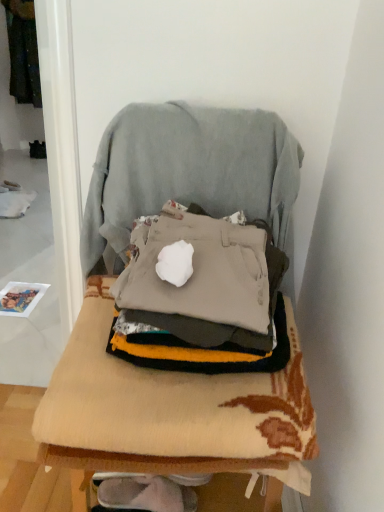
In order to face light gray fabric swivel chair at center, should I rotate leftwards or rightwards?

Rotate your view left by about 1.051°.

What do you see at coordinates (192, 169) in the screenshot? The height and width of the screenshot is (512, 384). I see `light gray fabric swivel chair at center` at bounding box center [192, 169].

At what (x,y) coordinates should I click in order to perform the action: click on dark green fabric at upper left. Please return your answer as a coordinate pair (x, y). This screenshot has height=512, width=384. Looking at the image, I should click on (23, 52).

This screenshot has width=384, height=512. What do you see at coordinates (167, 406) in the screenshot?
I see `beige fabric chair at center` at bounding box center [167, 406].

Where is `beige knitted blanket at center`? beige knitted blanket at center is located at coordinates (168, 405).

Describe the element at coordinates (168, 405) in the screenshot. I see `beige knitted blanket at center` at that location.

Where is `light gray fabric swivel chair at center`? The width and height of the screenshot is (384, 512). light gray fabric swivel chair at center is located at coordinates (192, 169).

Can you see dark green fabric at upper left touching light gray fabric swivel chair at center?

No, dark green fabric at upper left is not in contact with light gray fabric swivel chair at center.

Looking at this image, could light gray fabric swivel chair at center be considered to be inside dark green fabric at upper left?

No.

Does dark green fabric at upper left have a greater width compared to light gray fabric swivel chair at center?

Correct, the width of dark green fabric at upper left exceeds that of light gray fabric swivel chair at center.

Which is in front, point (29, 60) or point (108, 149)?

Point (108, 149)

Which object is positioned more to the left, beige fabric chair at center or beige knitted blanket at center?

beige fabric chair at center.

Which object is further away from the camera, beige fabric chair at center or beige knitted blanket at center?

beige knitted blanket at center is further away from the camera.

Considering the relative sizes of beige fabric chair at center and beige knitted blanket at center in the image provided, is beige fabric chair at center shorter than beige knitted blanket at center?

No.

Is point (248, 388) closer to camera compared to point (290, 432)?

No, (248, 388) is further to viewer.

Based on the photo, which object is further away from the camera taking this photo, beige knitted blanket at center or beige fabric chair at center?

Positioned behind is beige knitted blanket at center.

Identify the location of furniture to the left of beige knitted blanket at center. (167, 406).

Is beige knitted blanket at center inside the boundaries of beige fabric chair at center, or outside?

A: beige knitted blanket at center is enclosed within beige fabric chair at center.

From the image's perspective, relative to dark green fabric at upper left, is beige knitted blanket at center above or below?

beige knitted blanket at center is below dark green fabric at upper left.

There is a beige knitted blanket at center. Where is `clothing above it (from a real-world perspective)`? The height and width of the screenshot is (512, 384). clothing above it (from a real-world perspective) is located at coordinates pyautogui.click(x=23, y=52).

Which of these two, beige knitted blanket at center or dark green fabric at upper left, stands taller?

dark green fabric at upper left is taller.

Who is more distant, beige knitted blanket at center or light gray fabric swivel chair at center?

light gray fabric swivel chair at center.

In terms of width, does beige knitted blanket at center look wider or thinner when compared to light gray fabric swivel chair at center?

beige knitted blanket at center is wider than light gray fabric swivel chair at center.

From a real-world perspective, between beige knitted blanket at center and light gray fabric swivel chair at center, who is vertically higher?

light gray fabric swivel chair at center.

Locate an element on the screen. Image resolution: width=384 pixels, height=512 pixels. furniture that is below the light gray fabric swivel chair at center (from the image's perspective) is located at coordinates (167, 406).

Between light gray fabric swivel chair at center and beige fabric chair at center, which one is positioned behind?

light gray fabric swivel chair at center is more distant.

Consider the image. Which object is wider, light gray fabric swivel chair at center or beige fabric chair at center?

With larger width is beige fabric chair at center.

From the image's perspective, which one is positioned higher, light gray fabric swivel chair at center or beige fabric chair at center?

light gray fabric swivel chair at center is shown above in the image.

Considering the positions of points (264, 177) and (19, 35), is point (264, 177) closer to camera compared to point (19, 35)?

Yes.

Does light gray fabric swivel chair at center have a smaller size compared to dark green fabric at upper left?

Yes, light gray fabric swivel chair at center is smaller than dark green fabric at upper left.

Which object is thinner, light gray fabric swivel chair at center or dark green fabric at upper left?

light gray fabric swivel chair at center.

From the image's perspective, is light gray fabric swivel chair at center located above or below dark green fabric at upper left?

light gray fabric swivel chair at center is below dark green fabric at upper left.

Where is `clothing to the left of light gray fabric swivel chair at center`? clothing to the left of light gray fabric swivel chair at center is located at coordinates (23, 52).

Identify the location of furniture in front of the beige knitted blanket at center. The width and height of the screenshot is (384, 512). (167, 406).

Estimate the real-world distances between objects in this image. Which object is further from beige knitted blanket at center, dark green fabric at upper left or beige fabric chair at center?

dark green fabric at upper left lies further to beige knitted blanket at center than the other object.

Estimate the real-world distances between objects in this image. Which object is closer to dark green fabric at upper left, beige fabric chair at center or light gray fabric swivel chair at center?

light gray fabric swivel chair at center lies closer to dark green fabric at upper left than the other object.

Estimate the real-world distances between objects in this image. Which object is further from light gray fabric swivel chair at center, dark green fabric at upper left or beige fabric chair at center?

dark green fabric at upper left is positioned further to the anchor light gray fabric swivel chair at center.

Based on their spatial positions, is light gray fabric swivel chair at center or beige knitted blanket at center further from beige fabric chair at center?

light gray fabric swivel chair at center lies further to beige fabric chair at center than the other object.

When comparing their distances from light gray fabric swivel chair at center, does beige knitted blanket at center or dark green fabric at upper left seem closer?

beige knitted blanket at center is closer to light gray fabric swivel chair at center.

Looking at this image, estimate the real-world distances between objects in this image. Which object is closer to light gray fabric swivel chair at center, dark green fabric at upper left or beige knitted blanket at center?

beige knitted blanket at center lies closer to light gray fabric swivel chair at center than the other object.

Estimate the real-world distances between objects in this image. Which object is closer to beige knitted blanket at center, beige fabric chair at center or dark green fabric at upper left?

Based on the image, beige fabric chair at center appears to be nearer to beige knitted blanket at center.

Estimate the real-world distances between objects in this image. Which object is further from dark green fabric at upper left, beige fabric chair at center or beige knitted blanket at center?

beige knitted blanket at center is further to dark green fabric at upper left.

Identify the location of blanket between beige fabric chair at center and dark green fabric at upper left in the front-back direction. The image size is (384, 512). (168, 405).

Where is `blanket between beige fabric chair at center and light gray fabric swivel chair at center from front to back`? blanket between beige fabric chair at center and light gray fabric swivel chair at center from front to back is located at coordinates (168, 405).

The width and height of the screenshot is (384, 512). Find the location of `swivel chair located between beige knitted blanket at center and dark green fabric at upper left in the depth direction`. swivel chair located between beige knitted blanket at center and dark green fabric at upper left in the depth direction is located at coordinates (192, 169).

Locate an element on the screen. The image size is (384, 512). swivel chair located between beige fabric chair at center and dark green fabric at upper left in the depth direction is located at coordinates (192, 169).